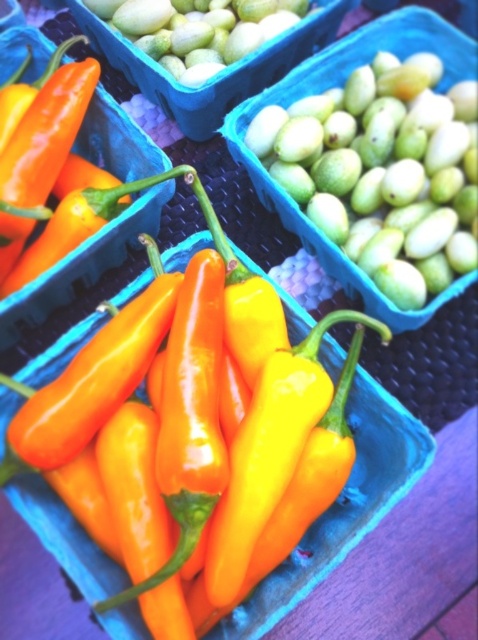
Question: Can you confirm if green matte melon at upper right is positioned to the right of green matte melon at upper center?

Choices:
 (A) yes
 (B) no

Answer: (A)

Question: Which point is closer to the camera?

Choices:
 (A) green matte melon at upper center
 (B) green matte melon at upper right

Answer: (B)

Question: Is green matte melon at upper right thinner than green matte melon at upper center?

Choices:
 (A) no
 (B) yes

Answer: (B)

Question: Observing the image, what is the correct spatial positioning of green matte melon at upper right in reference to green matte melon at upper center?

Choices:
 (A) below
 (B) above

Answer: (A)